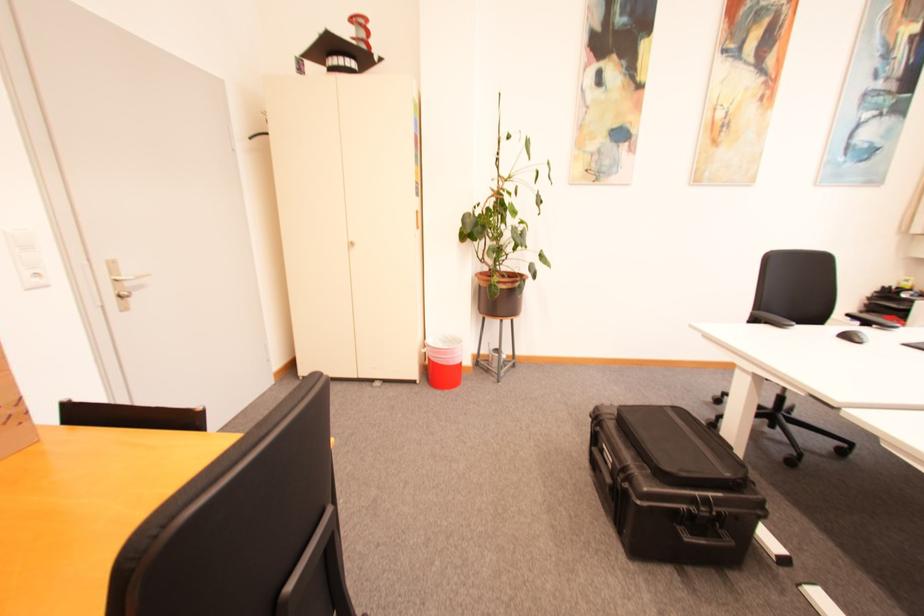
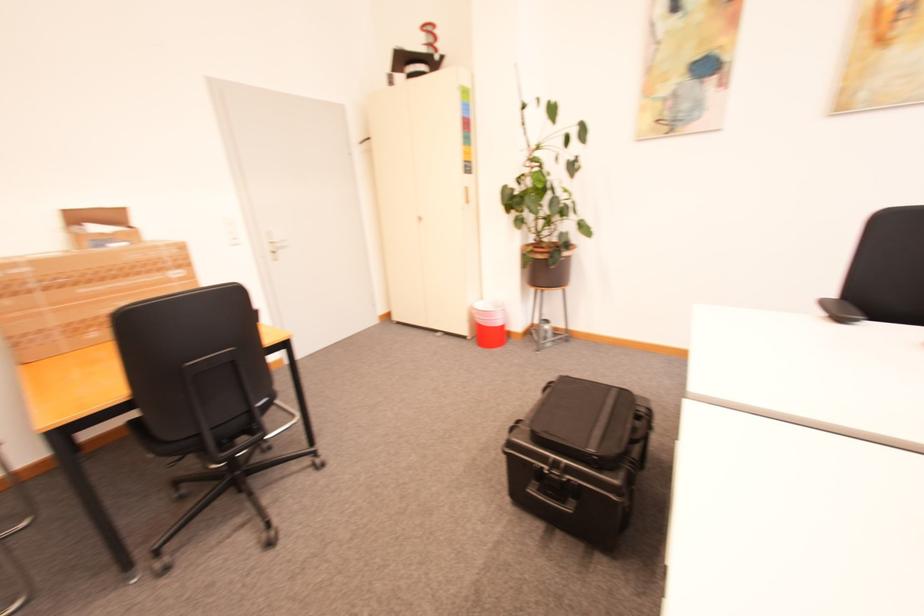
Locate, in the second image, the point that corresponds to (x=424, y=383) in the first image.

(476, 339)